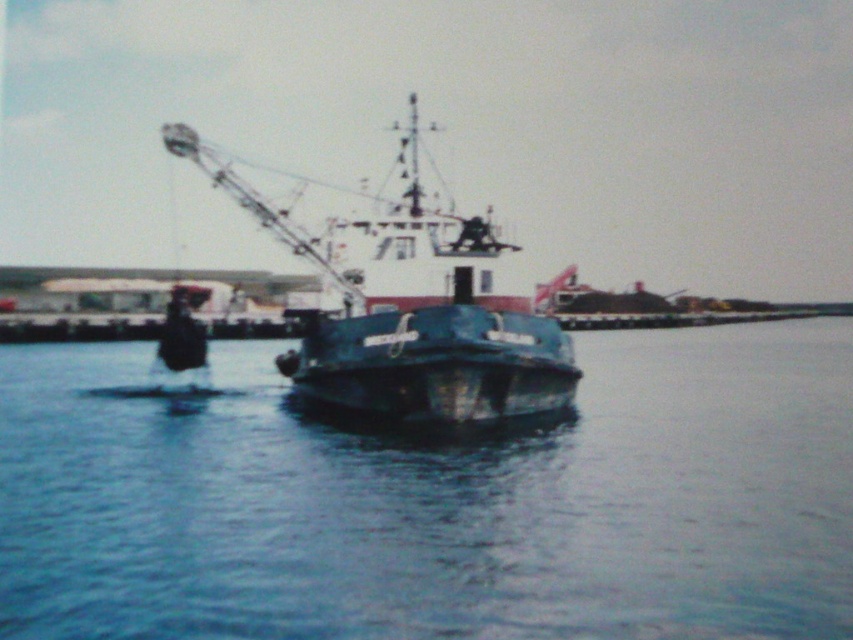
You are standing on the dock and looking at the blue metallic boat at center. There is also blue matte water at center. Which one is nearer to you?

The blue matte water at center is closer to the viewer than the blue metallic boat at center, so the blue matte water at center is nearer to you.

You are standing on the dock and see the blue metallic boat at center and the blue matte water at center. Which object is positioned to the right of the other?

The blue matte water at center is to the right of the blue metallic boat at center.

You are navigating a small drone that needs to hover exactly at the coordinates given for the blue matte water at center. What coordinates should you set your drone to?

The blue matte water at center is located at coordinates point (437,500), so you should set your drone to hover at those coordinates.